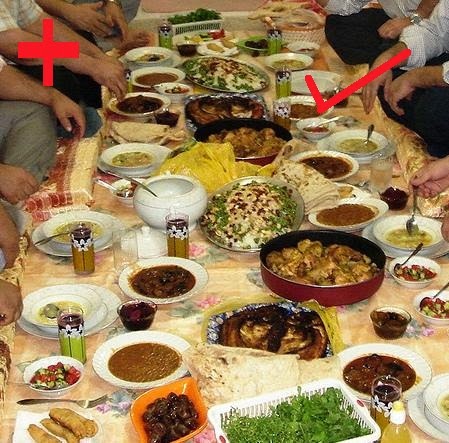
Find the location of `fork`. fork is located at coordinates (81, 401).